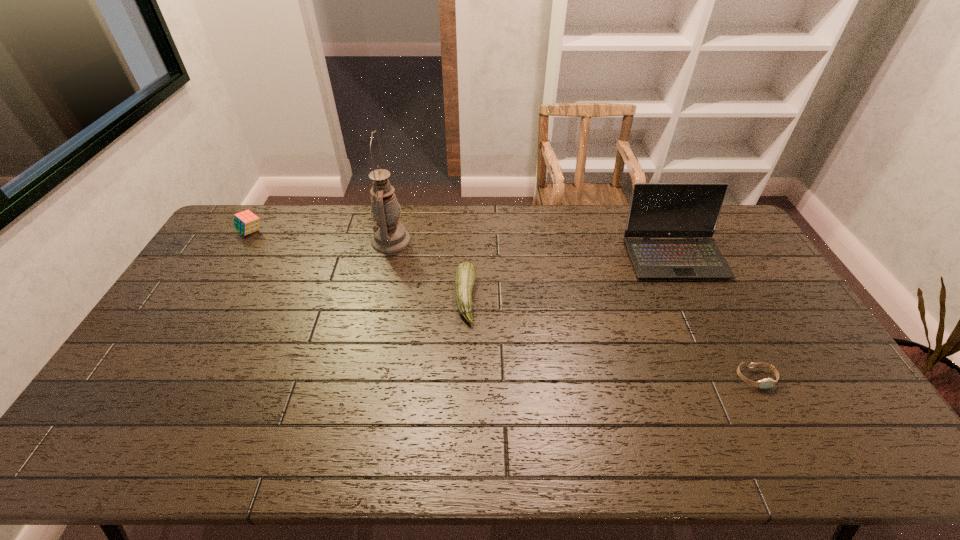
Image resolution: width=960 pixels, height=540 pixels. I want to click on vacant space situated 0.110m on the screen of the fourth shortest object, so click(698, 306).

Where is `vacant position located 0.340m on the front of the third shortest object`? The height and width of the screenshot is (540, 960). vacant position located 0.340m on the front of the third shortest object is located at coordinates (204, 308).

Identify the location of vacant position located at the stem end of the third object from right to left. Image resolution: width=960 pixels, height=540 pixels. (556, 298).

You are a GUI agent. You are given a task and a screenshot of the screen. Output one action in this format:
    pyautogui.click(x=<x>, y=<y>)
    Task: Click on the free space located on the face of the shortest object
    
    Given the screenshot: What is the action you would take?
    pos(785,436)

This screenshot has height=540, width=960. I want to click on oil lamp that is at the far edge, so [389, 236].

Find the location of a particular element. laptop computer positioned at the far edge is located at coordinates (657, 210).

Where is `cube present at the far edge`? The image size is (960, 540). cube present at the far edge is located at coordinates (246, 222).

Where is `object that is at the left edge`? This screenshot has width=960, height=540. object that is at the left edge is located at coordinates (246, 222).

Where is `object located in the right edge section of the desktop`? The image size is (960, 540). object located in the right edge section of the desktop is located at coordinates (657, 210).

This screenshot has height=540, width=960. I want to click on object present at the far left corner, so click(246, 222).